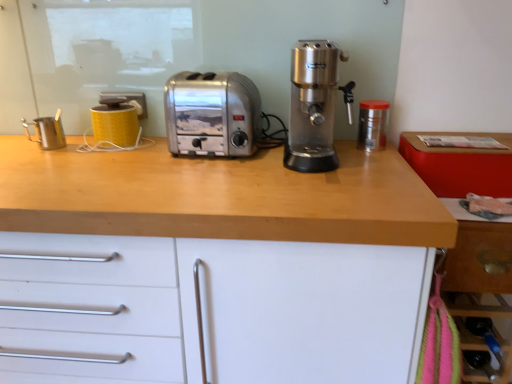
Where is `free spot to the right of metallic stainless steel pitcher at left, positioned as the third kitchen appliance in right-to-left order`? free spot to the right of metallic stainless steel pitcher at left, positioned as the third kitchen appliance in right-to-left order is located at coordinates (95, 149).